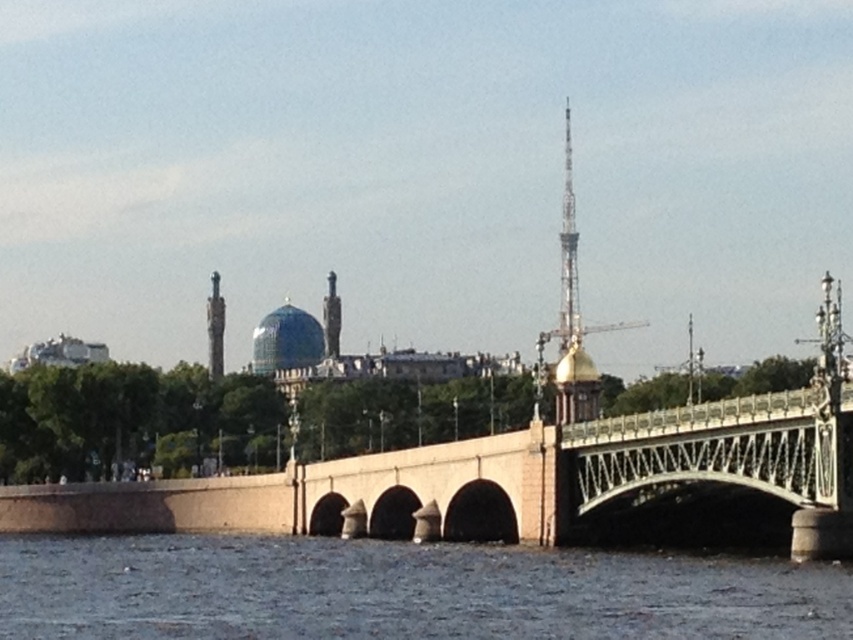
Question: Does metallic silver tower at upper center come in front of blue dome at center?

Choices:
 (A) yes
 (B) no

Answer: (A)

Question: Is stone bridge at center smaller than polished bronze statue at left?

Choices:
 (A) yes
 (B) no

Answer: (B)

Question: Considering the real-world distances, which object is closest to the blue dome at center?

Choices:
 (A) gray concrete river at lower center
 (B) polished bronze statue at left
 (C) stone bridge at center
 (D) metallic silver tower at upper center

Answer: (B)

Question: Which point is closer to the camera?

Choices:
 (A) blue dome at center
 (B) stone bridge at center

Answer: (B)

Question: Estimate the real-world distances between objects in this image. Which object is farther from the blue dome at center?

Choices:
 (A) gray concrete river at lower center
 (B) polished bronze statue at left

Answer: (A)

Question: Can you confirm if metallic silver tower at upper center is positioned below blue dome at center?

Choices:
 (A) yes
 (B) no

Answer: (B)